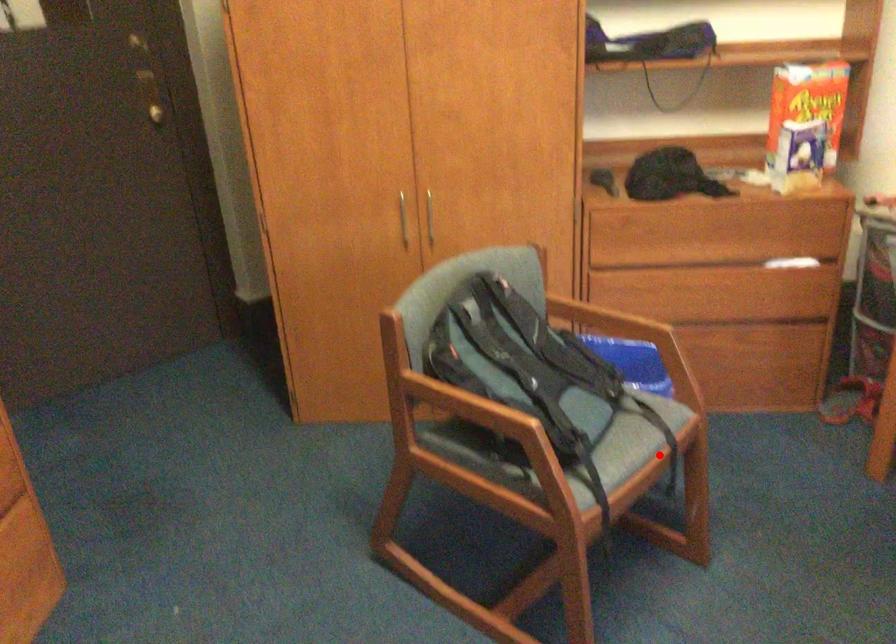
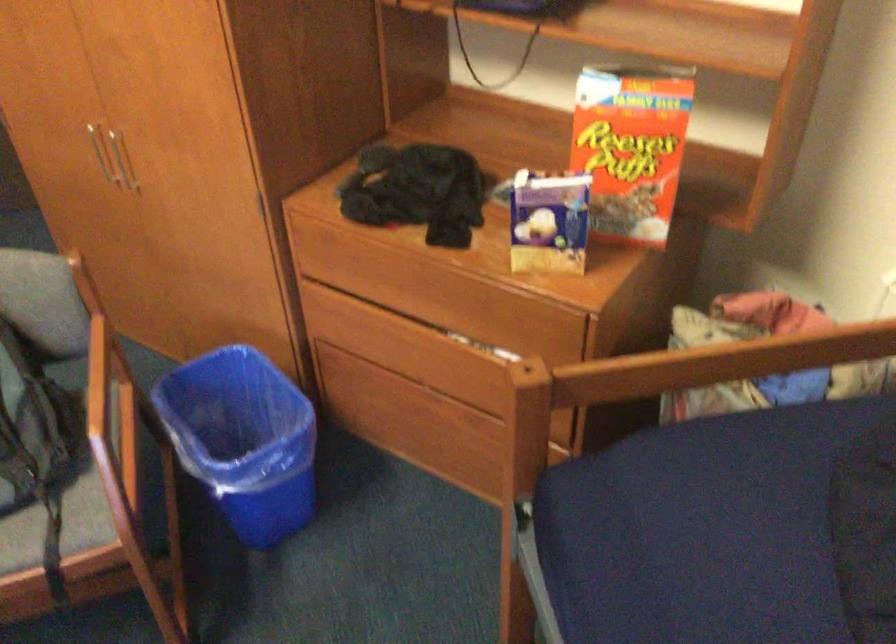
Question: I am providing you with two images of the same scene from different viewpoints. Given a red point in image1, look at the same physical point in image2. Is it:

Choices:
 (A) Closer to the viewpoint
 (B) Farther from the viewpoint

Answer: (A)